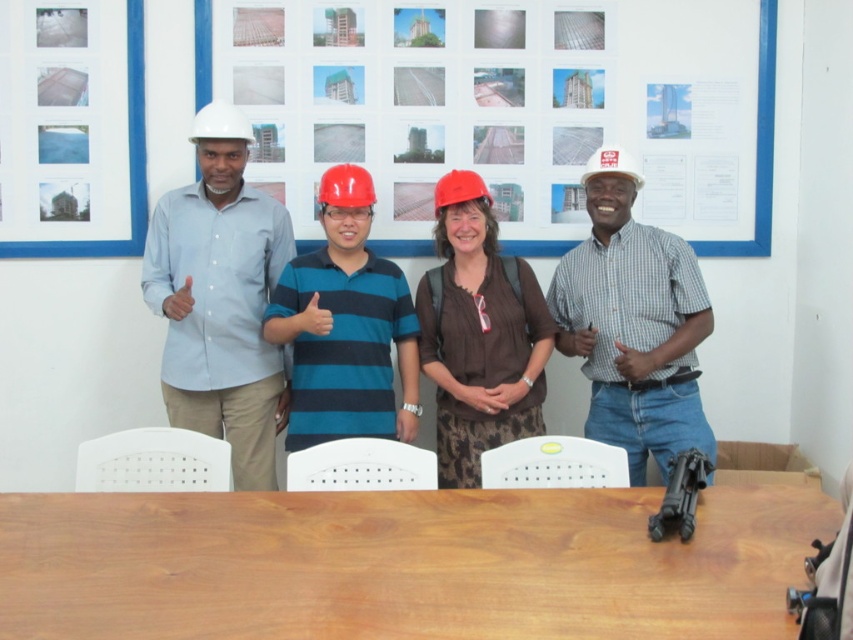
You are a delivery person with a box that is 6 feet long. You need to place the box between the wooden table at center and the metallic silver construction photos at upper center. Is there enough space to fit the box between them?

The distance between the wooden table at center and the metallic silver construction photos at upper center is 5.33 feet. Since the box is 6 feet long, it will not fit between them as the space is shorter than the box.

You are standing in the meeting room and want to take a photo of the two points marked in the image. Which point, point (305, 413) or point (463, 184), will appear larger in your photo?

Point (305, 413) is closer to the camera than point (463, 184), so it will appear larger in the photo.